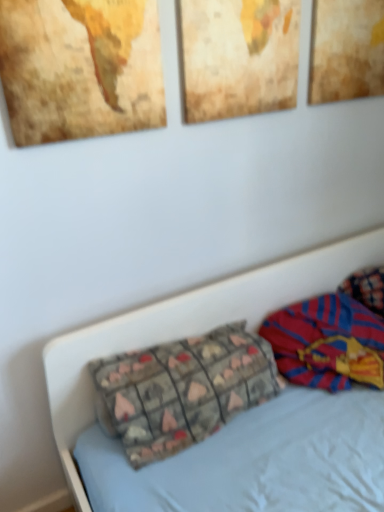
Question: Is wooden map at upper left, which is the first picture frame from left to right, aimed at textured paper picture frame at upper right, which is the third picture frame in left-to-right order?

Choices:
 (A) no
 (B) yes

Answer: (A)

Question: Does wooden map at upper left, which is the first picture frame from left to right, appear on the right side of textured paper picture frame at upper right, the 1th picture frame positioned from the right?

Choices:
 (A) yes
 (B) no

Answer: (B)

Question: From a real-world perspective, is wooden map at upper left, which is the first picture frame from left to right, positioned over textured paper picture frame at upper right, the 1th picture frame positioned from the right, based on gravity?

Choices:
 (A) no
 (B) yes

Answer: (B)

Question: Does wooden map at upper left, which appears as the 3th picture frame when viewed from the right, come behind textured paper picture frame at upper right, which is the third picture frame in left-to-right order?

Choices:
 (A) no
 (B) yes

Answer: (A)

Question: Is wooden map at upper left, which is the first picture frame from left to right, oriented away from textured paper picture frame at upper right, the 1th picture frame positioned from the right?

Choices:
 (A) yes
 (B) no

Answer: (B)

Question: Does wooden map at upper left, which is the first picture frame from left to right, appear on the left side of textured paper picture frame at upper right, the 1th picture frame positioned from the right?

Choices:
 (A) yes
 (B) no

Answer: (A)

Question: From a real-world perspective, is textured fabric pillow at center physically above wooden map at upper left, which appears as the 3th picture frame when viewed from the right?

Choices:
 (A) yes
 (B) no

Answer: (B)

Question: From the image's perspective, would you say textured fabric pillow at center is positioned over wooden map at upper left, which appears as the 3th picture frame when viewed from the right?

Choices:
 (A) yes
 (B) no

Answer: (B)

Question: From a real-world perspective, is textured fabric pillow at center under wooden map at upper left, which appears as the 3th picture frame when viewed from the right?

Choices:
 (A) no
 (B) yes

Answer: (B)

Question: Can we say textured fabric pillow at center lies outside wooden map at upper left, which is the first picture frame from left to right?

Choices:
 (A) no
 (B) yes

Answer: (B)

Question: Considering the relative sizes of textured fabric pillow at center and wooden map at upper left, which appears as the 3th picture frame when viewed from the right, in the image provided, is textured fabric pillow at center smaller than wooden map at upper left, which appears as the 3th picture frame when viewed from the right,?

Choices:
 (A) no
 (B) yes

Answer: (A)

Question: From the image's perspective, is textured fabric pillow at center beneath wooden map at upper left, which appears as the 3th picture frame when viewed from the right?

Choices:
 (A) no
 (B) yes

Answer: (B)

Question: Does wooden map at upper left, which is the first picture frame from left to right, have a lesser width compared to textured fabric pillow at center?

Choices:
 (A) no
 (B) yes

Answer: (B)